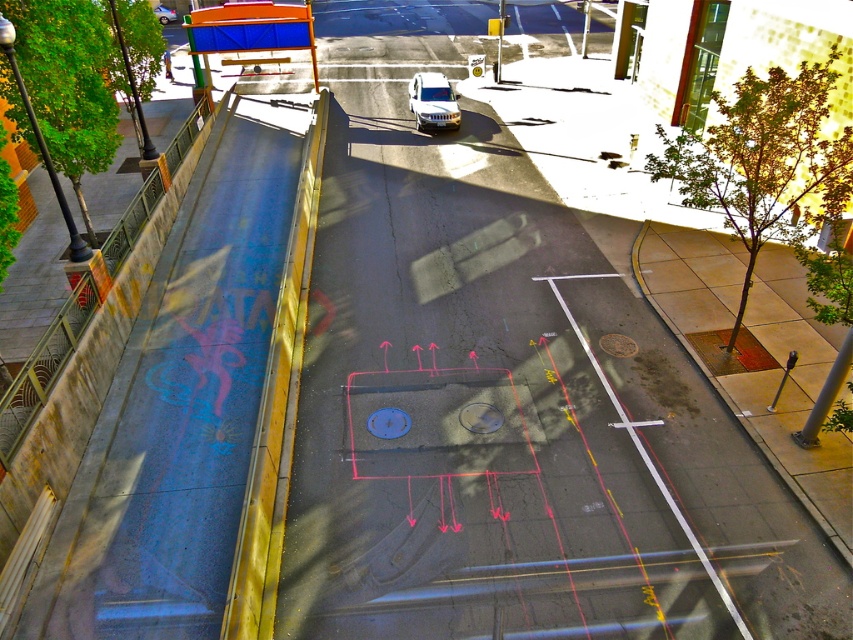
You are a delivery driver who needs to park your vehicle in the loading zone. You see a white matte van at center and a metallic silver sedan at center. Which vehicle should you avoid parking in front of to ensure the sedan can exit easily?

The white matte van at center is in front of the metallic silver sedan at center. To ensure the sedan can exit easily, you should avoid parking in front of the metallic silver sedan at center.

You are standing on the bridge looking down at the street. You see two points marked on the image. Which point, point (440, 124) or point (167, 13), is closer to you?

Point (440, 124) is closer to the viewer than point (167, 13).